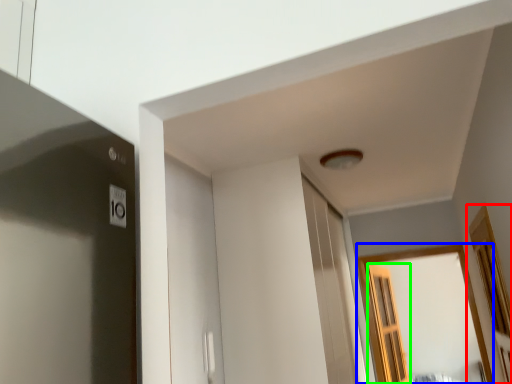
Question: Which object is positioned closest to window (highlighted by a red box)? Select from window (highlighted by a blue box) and screen door (highlighted by a green box).

Choices:
 (A) window
 (B) screen door

Answer: (A)